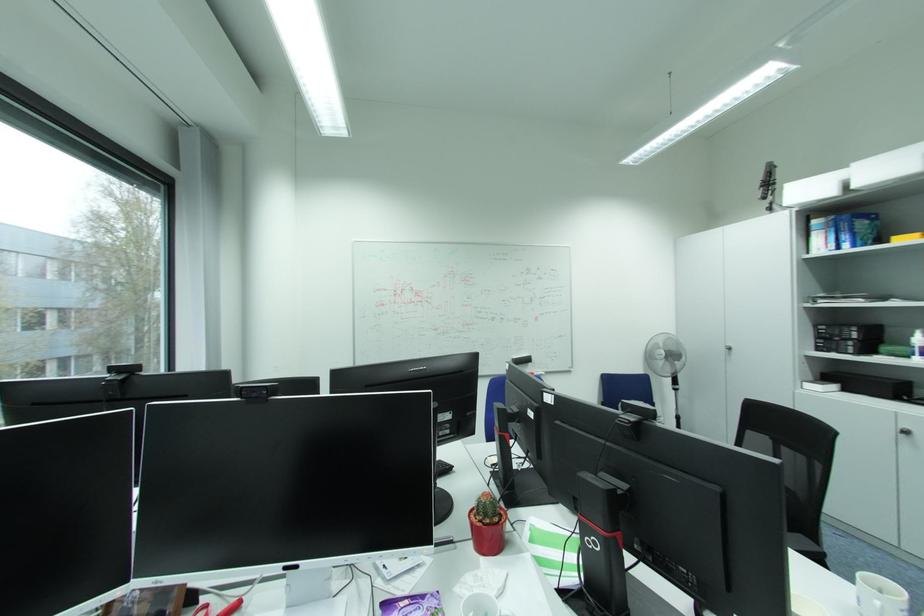
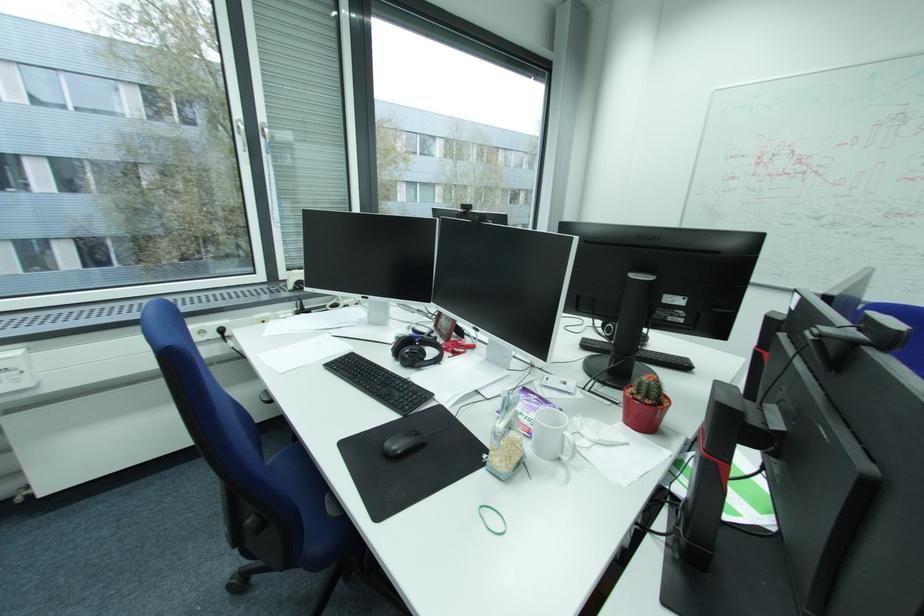
Locate, in the second image, the point that corresponds to point (492, 560) in the first image.

(629, 424)